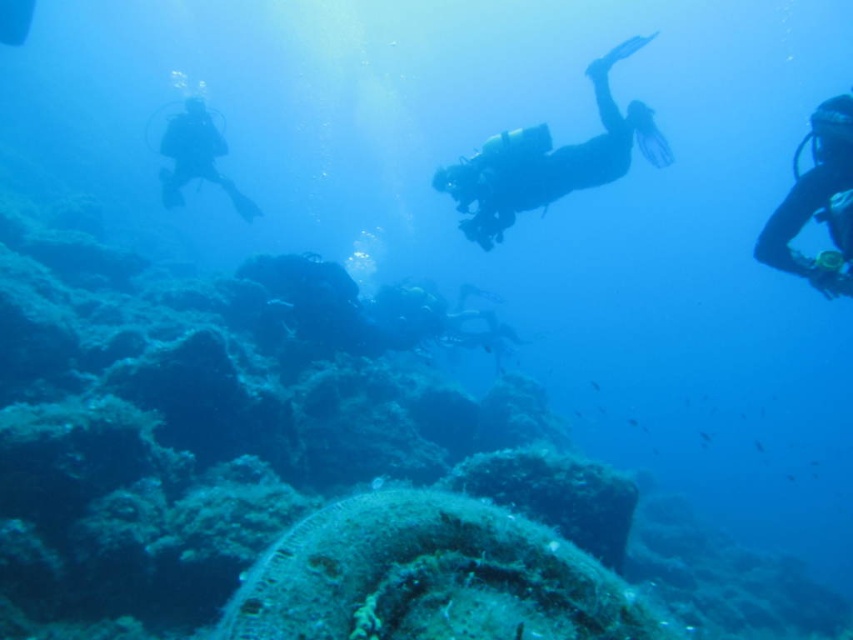
You are a new scuba diver preparing to join the group in the image. You see two divers labeled as the black matte scuba diver at center and the black matte scuba diver at right. Which of these two divers is located to the left when viewed from your perspective?

The black matte scuba diver at center is positioned on the left side of the black matte scuba diver at right, so from your perspective, the black matte scuba diver at center is the one located to the left.

You are a scuba diver looking at the underwater scene. There are two points marked in the image, point A at coordinates point (596, 68) and point B at coordinates point (219, 156). If you want to reach the point closer to the camera first, which point should you swim towards?

Point A at coordinates point (596, 68) is closer to the camera than point B at coordinates point (219, 156), so you should swim towards point A first.